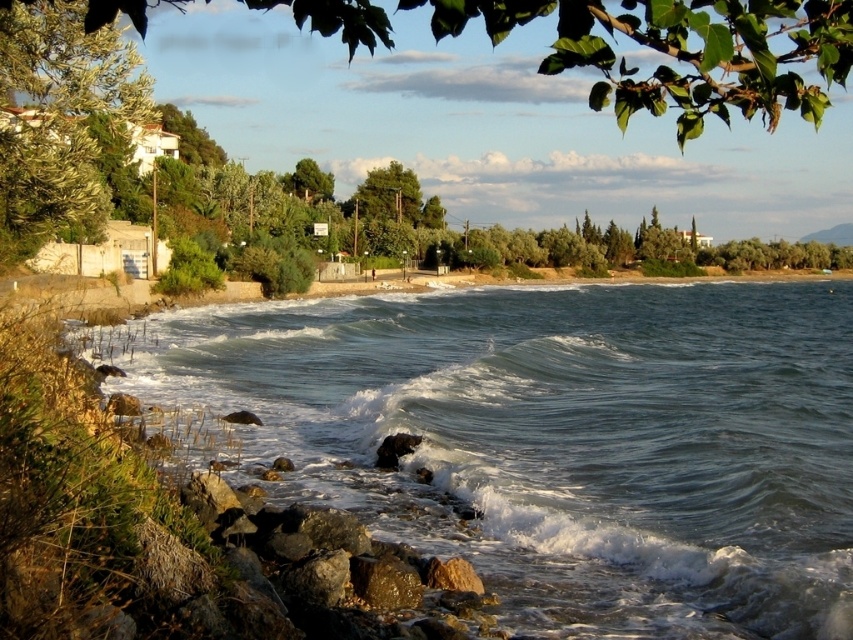
Question: Which of the following is the closest to the observer?

Choices:
 (A) clear blue water at center
 (B) green leafy tree at upper center

Answer: (B)

Question: Which point appears farthest from the camera in this image?

Choices:
 (A) (26, 179)
 (B) (514, 8)
 (C) (804, 362)

Answer: (C)

Question: Is clear blue water at center to the left of green leafy tree at upper center from the viewer's perspective?

Choices:
 (A) yes
 (B) no

Answer: (A)

Question: Can you confirm if green leafy tree at upper center is smaller than green leafy tree at upper left?

Choices:
 (A) yes
 (B) no

Answer: (B)

Question: Estimate the real-world distances between objects in this image. Which object is farther from the green leafy tree at upper center?

Choices:
 (A) clear blue water at center
 (B) green leafy tree at upper left

Answer: (A)

Question: Considering the relative positions of clear blue water at center and green leafy tree at upper left in the image provided, where is clear blue water at center located with respect to green leafy tree at upper left?

Choices:
 (A) above
 (B) below

Answer: (B)